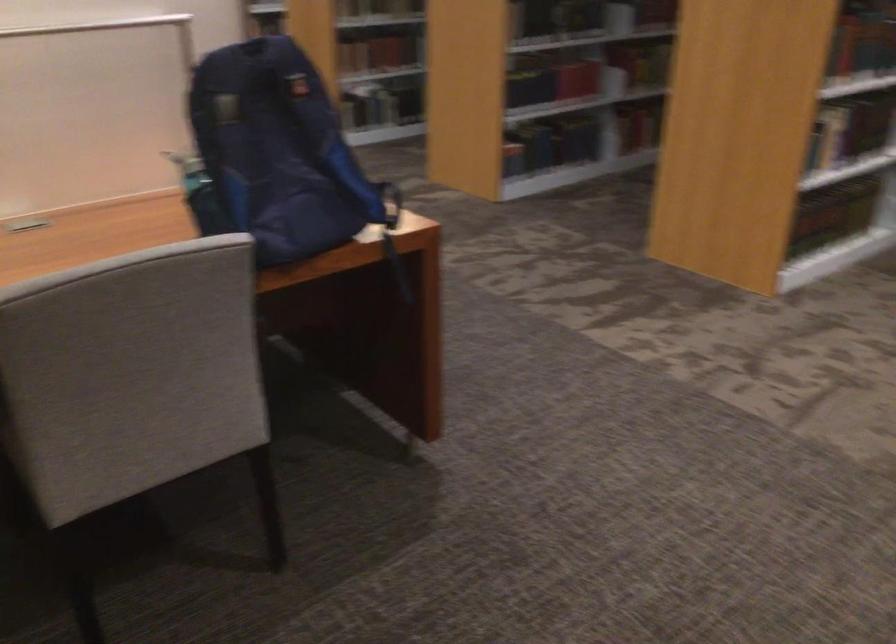
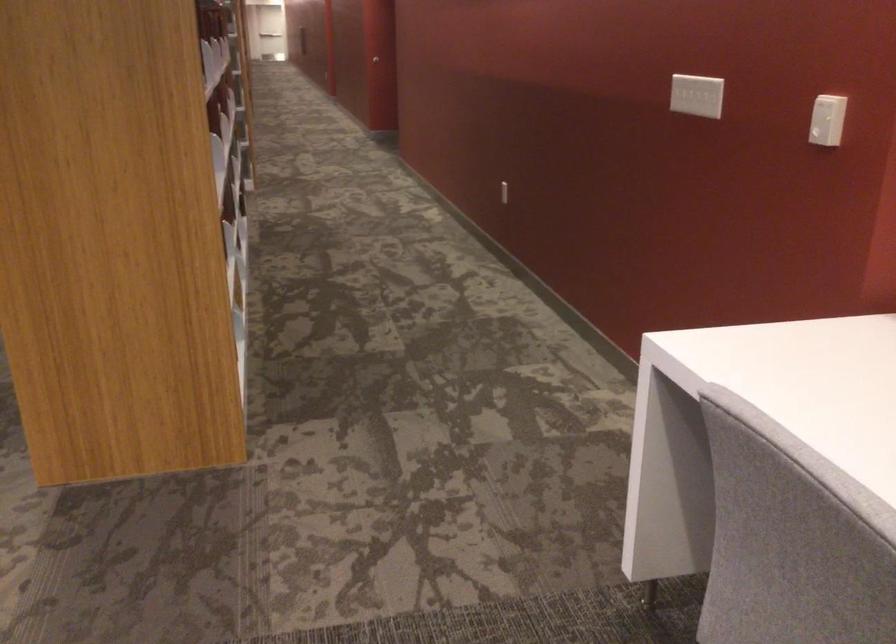
Question: The images are taken continuously from a first-person perspective. In which direction is your viewpoint rotating?

Choices:
 (A) Left
 (B) Right
 (C) Up
 (D) Down

Answer: (B)